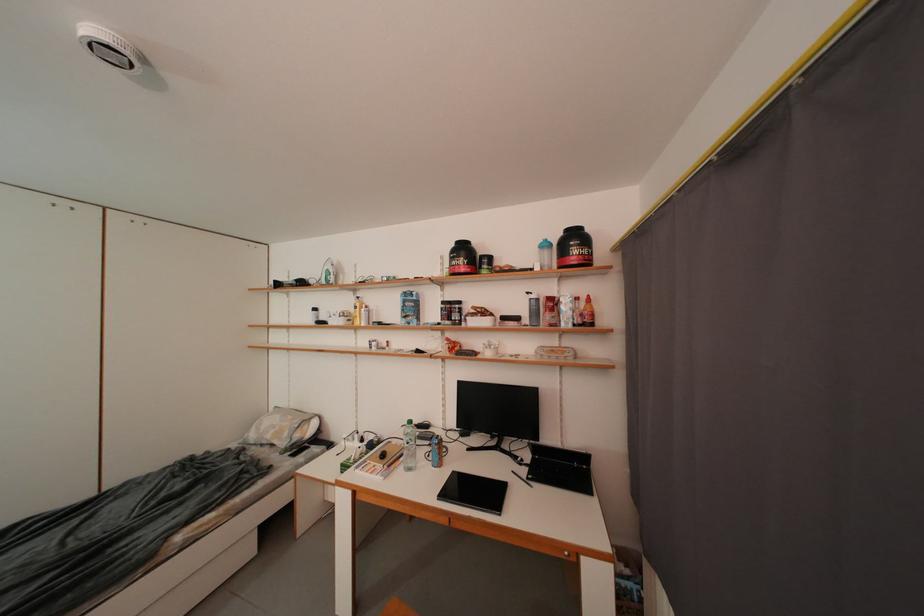
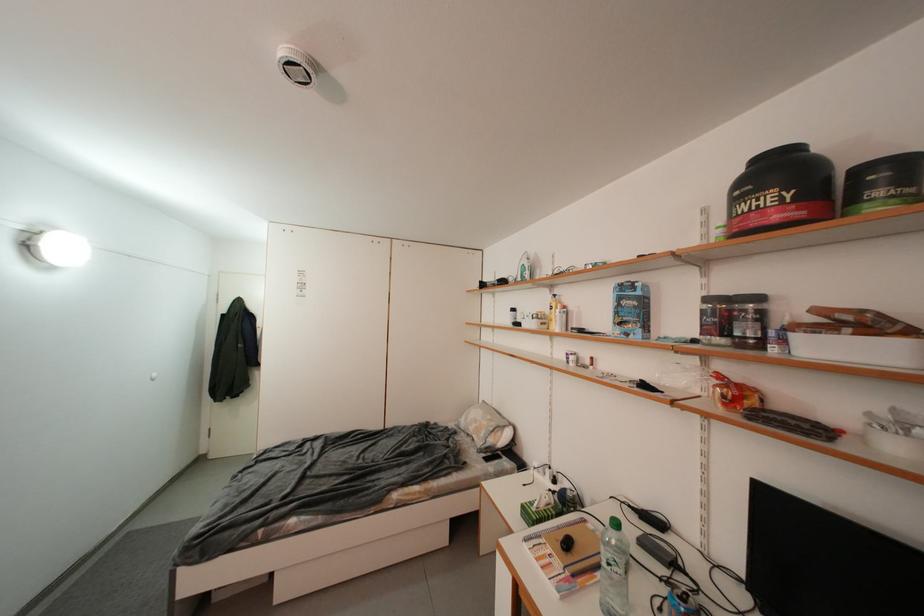
Locate, in the second image, the point that corresponds to point 490,261 in the first image.

(869, 174)